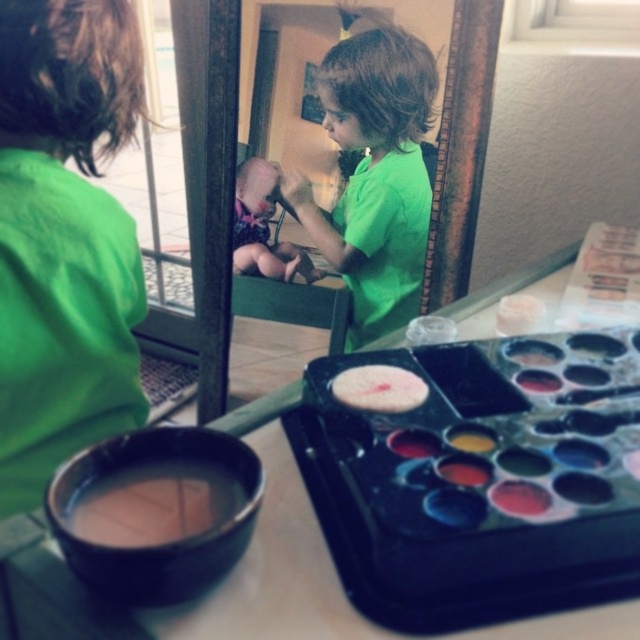
You are a parent trying to clean up the play area. The shiny plastic paint tray at lower right has spilled paint. Which direction should you move it to avoid the doll on the table?

The shiny plastic paint tray at lower right is located at point (480, 481). Since it is at the lower right, moving it towards the upper left would take it away from the doll positioned on the table in front of the child.

You are a parent observing your child at a table. You notice the green matte shirt at upper left and the brown matte paint at lower left. Which object is bigger in size?

The green matte shirt at upper left is larger in size than the brown matte paint at lower left.

Consider the image. You are a parent observing your child at the table. You notice the shiny plastic paint tray at lower right and the green matte shirt at center. Which object is smaller in size?

The shiny plastic paint tray at lower right is smaller than the green matte shirt at center.